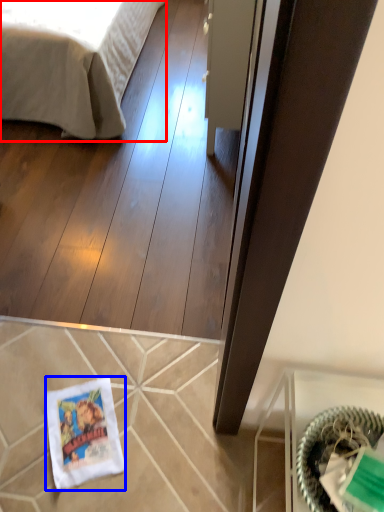
Question: Which point is closer to the camera, bed (highlighted by a red box) or material (highlighted by a blue box)?

Choices:
 (A) bed
 (B) material

Answer: (B)